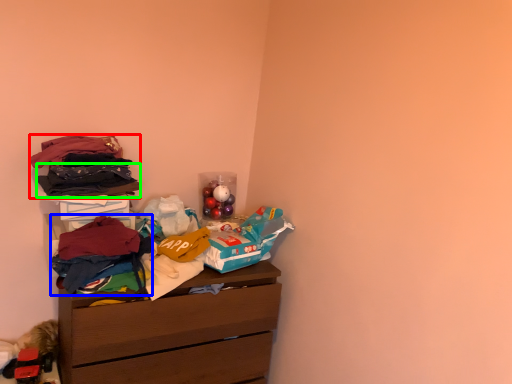
Question: Based on their relative distances, which object is nearer to clothing (highlighted by a red box)? Choose from clothing (highlighted by a blue box) and clothing (highlighted by a green box).

Choices:
 (A) clothing
 (B) clothing

Answer: (B)